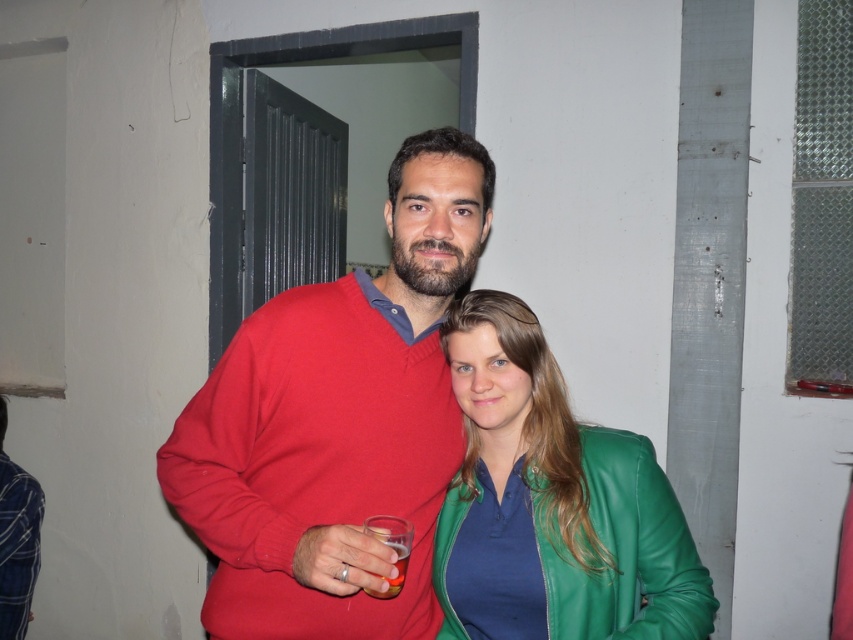
Question: Can you confirm if matte red sweater at center is positioned to the left of translucent plastic cup at center?

Choices:
 (A) yes
 (B) no

Answer: (A)

Question: Which point is farther to the camera?

Choices:
 (A) matte red sweater at center
 (B) translucent plastic cup at center
 (C) green leather jacket at center

Answer: (C)

Question: Is green leather jacket at center in front of translucent plastic cup at center?

Choices:
 (A) yes
 (B) no

Answer: (B)

Question: Is matte red sweater at center to the left of translucent plastic cup at center from the viewer's perspective?

Choices:
 (A) no
 (B) yes

Answer: (B)

Question: Which point is farther to the camera?

Choices:
 (A) translucent plastic cup at center
 (B) green leather jacket at center
 (C) matte red sweater at center

Answer: (B)

Question: Estimate the real-world distances between objects in this image. Which object is closer to the matte red sweater at center?

Choices:
 (A) translucent plastic cup at center
 (B) green leather jacket at center

Answer: (B)